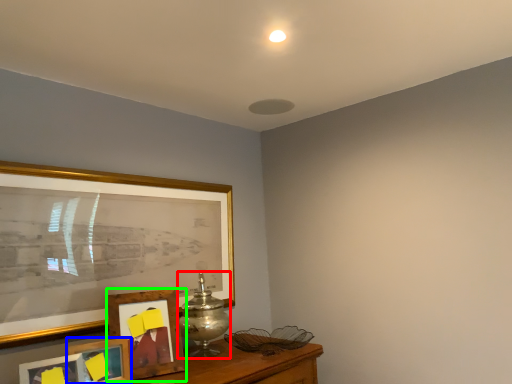
Question: Which object is the farthest from table lamp (highlighted by a red box)? Choose among these: picture frame (highlighted by a blue box) or picture frame (highlighted by a green box).

Choices:
 (A) picture frame
 (B) picture frame

Answer: (A)